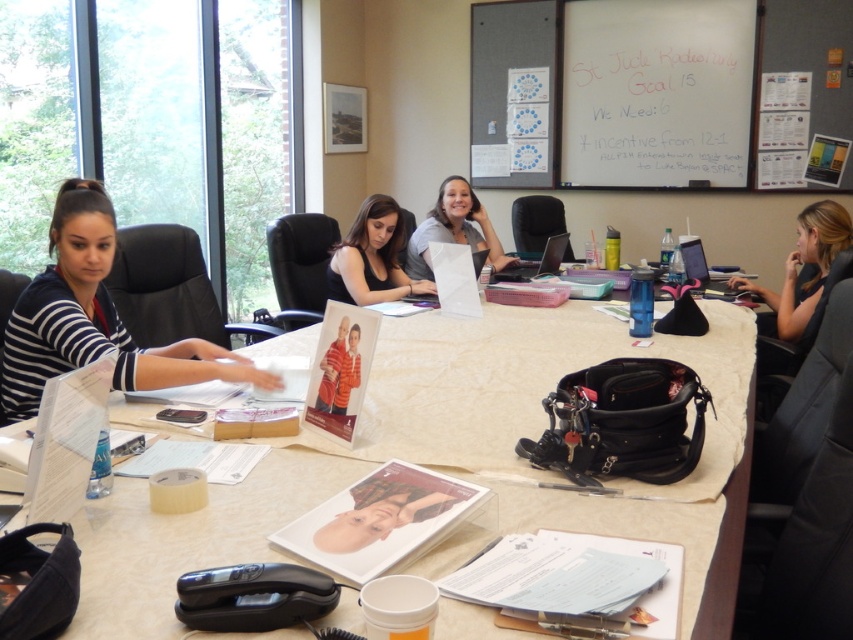
You are standing at the conference table and want to reach both the point at (x=578, y=122) and the point at (x=827, y=224). Which point will you reach first as you move towards them?

You will reach the point at (x=578, y=122) first because it is closer to you than the point at (x=827, y=224), which is further away.

You are organizing a meeting and need to place a silver metallic laptop at center on the beige fabric table at center. Can the laptop fit on the table?

The beige fabric table at center is wider than the silver metallic laptop at center, so the laptop can fit on the table.

You are a meeting participant sitting at the conference table. You need to refer to the whiteboard at upper center but your black leather purse at lower right is blocking your view. Can you move the purse to the right to see the whiteboard better?

The whiteboard at upper center is already to the left of the black leather purse at lower right. Moving the purse to the right would place it further away from the whiteboard, allowing you to see the whiteboard more clearly.